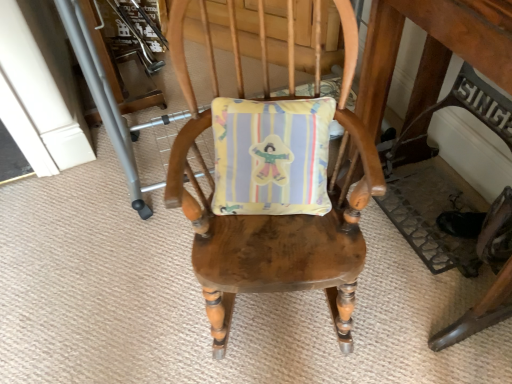
Describe the element at coordinates (432, 49) in the screenshot. I see `wooden table at center` at that location.

Locate an element on the screen. The image size is (512, 384). wooden table at center is located at coordinates (432, 49).

In order to face wooden table at center, should I rotate leftwards or rightwards?

You should rotate right by 27.553 degrees.

Locate an element on the screen. This screenshot has width=512, height=384. wooden chair at center is located at coordinates (274, 192).

The image size is (512, 384). Describe the element at coordinates (274, 192) in the screenshot. I see `wooden chair at center` at that location.

This screenshot has width=512, height=384. What are the coordinates of `wooden table at center` in the screenshot? It's located at (432, 49).

Which is more to the left, wooden table at center or wooden chair at center?

Positioned to the left is wooden chair at center.

Is wooden table at center further to camera compared to wooden chair at center?

No, it is in front of wooden chair at center.

Is point (462, 54) closer or farther from the camera than point (166, 200)?

Point (462, 54).

From the image's perspective, is wooden table at center over wooden chair at center?

Indeed, from the image's perspective, wooden table at center is shown above wooden chair at center.

From a real-world perspective, is wooden table at center above or below wooden chair at center?

In terms of real-world spatial position, wooden table at center is above wooden chair at center.

Based on the photo, can you confirm if wooden table at center is thinner than wooden chair at center?

Correct, the width of wooden table at center is less than that of wooden chair at center.

Is wooden table at center shorter than wooden chair at center?

No, wooden table at center is not shorter than wooden chair at center.

Based on the photo, can you confirm if wooden table at center is bigger than wooden chair at center?

Yes, wooden table at center is bigger than wooden chair at center.

Choose the correct answer: Is wooden table at center inside wooden chair at center or outside it?

wooden table at center is located beyond the bounds of wooden chair at center.

Would you consider wooden table at center to be distant from wooden chair at center?

wooden table at center is actually quite close to wooden chair at center.

Looking at this image, does wooden table at center turn towards wooden chair at center?

Yes, wooden table at center is turned towards wooden chair at center.

At what (x,y) coordinates should I click in order to perform the action: click on table to the right of wooden chair at center. Please return your answer as a coordinate pair (x, y). The width and height of the screenshot is (512, 384). Looking at the image, I should click on (432, 49).

Is wooden chair at center to the right of wooden table at center from the viewer's perspective?

No.

In the image, is wooden chair at center positioned in front of or behind wooden table at center?

wooden chair at center is positioned farther from the viewer than wooden table at center.

Does point (211, 124) come behind point (378, 87)?

No, it is not.

From the image's perspective, who appears lower, wooden chair at center or wooden table at center?

wooden chair at center.

Consider the image. From a real-world perspective, is wooden chair at center located higher than wooden table at center?

No, from a real-world perspective, wooden chair at center is not above wooden table at center.

From the picture: Does wooden chair at center have a lesser width compared to wooden table at center?

In fact, wooden chair at center might be wider than wooden table at center.

Considering the sizes of objects wooden chair at center and wooden table at center in the image provided, who is taller, wooden chair at center or wooden table at center?

wooden table at center.

Based on the photo, between wooden chair at center and wooden table at center, which one has smaller size?

With smaller size is wooden chair at center.

Is wooden chair at center outside of wooden table at center?

Yes, wooden chair at center is located beyond the bounds of wooden table at center.

Is wooden chair at center not close to wooden table at center?

No.

Does wooden chair at center turn towards wooden table at center?

No, wooden chair at center is not oriented towards wooden table at center.

Can you tell me how much wooden chair at center and wooden table at center differ in facing direction?

There is a 68.8-degree angle between the facing directions of wooden chair at center and wooden table at center.

You are a GUI agent. You are given a task and a screenshot of the screen. Output one action in this format:
    pyautogui.click(x=<x>, y=<y>)
    Task: Click on the chair below the wooden table at center (from the image's perspective)
    Image resolution: width=512 pixels, height=384 pixels.
    Given the screenshot: What is the action you would take?
    pyautogui.click(x=274, y=192)

Identify the location of chair to the left of wooden table at center. (274, 192).

Identify the location of chair below the wooden table at center (from the image's perspective). (274, 192).